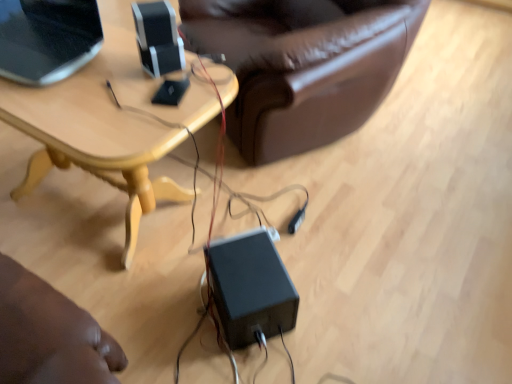
This screenshot has width=512, height=384. Find the location of `free location above black plastic power supply at center, which is the first speaker from bottom to top (from a real-world perspective)`. free location above black plastic power supply at center, which is the first speaker from bottom to top (from a real-world perspective) is located at coordinates (248, 266).